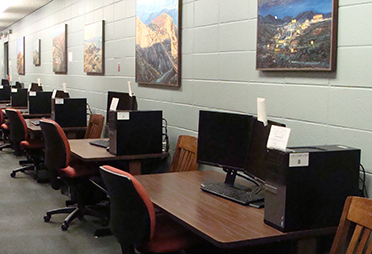
Locate an element on the screen. Image resolution: width=372 pixels, height=254 pixels. computer tower is located at coordinates (314, 158), (155, 130), (72, 115).